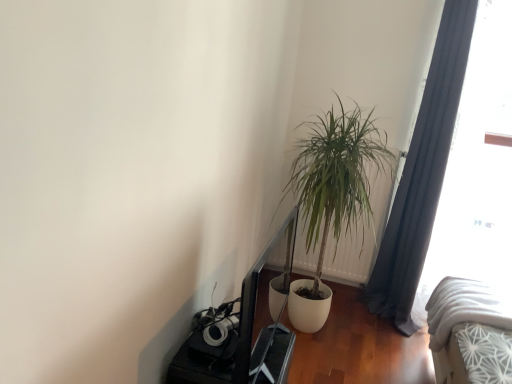
The height and width of the screenshot is (384, 512). What do you see at coordinates (333, 195) in the screenshot?
I see `green leafy plant at center` at bounding box center [333, 195].

The image size is (512, 384). Find the location of `dark gray fabric curtain at right`. dark gray fabric curtain at right is located at coordinates (422, 173).

This screenshot has width=512, height=384. Describe the element at coordinates (476, 167) in the screenshot. I see `transparent glass window at right` at that location.

This screenshot has width=512, height=384. In order to click on green leafy plant at center in this screenshot , I will do `click(333, 195)`.

From the image's perspective, is green leafy plant at center positioned above or below transparent glass window at right?

green leafy plant at center is situated lower than transparent glass window at right in the image.

Is green leafy plant at center thinner than transparent glass window at right?

In fact, green leafy plant at center might be wider than transparent glass window at right.

In the scene shown: From a real-world perspective, which is physically below, green leafy plant at center or transparent glass window at right?

green leafy plant at center.

Is green leafy plant at center positioned with its back to transparent glass window at right?

green leafy plant at center does not have its back to transparent glass window at right.

Considering the relative positions of white plastic radiator at center-right and transparent glass window at right in the image provided, is white plastic radiator at center-right to the right of transparent glass window at right from the viewer's perspective?

Incorrect, white plastic radiator at center-right is not on the right side of transparent glass window at right.

Does white plastic radiator at center-right have a larger size compared to transparent glass window at right?

Actually, white plastic radiator at center-right might be smaller than transparent glass window at right.

Does point (387, 169) appear closer or farther from the camera than point (458, 145)?

Point (387, 169) appears to be farther away from the viewer than point (458, 145).

Is white plastic radiator at center-right beside transparent glass window at right?

No, white plastic radiator at center-right is not making contact with transparent glass window at right.

From the image's perspective, is dark gray fabric curtain at right on green leafy plant at center?

Yes, from the image's perspective, dark gray fabric curtain at right is on top of green leafy plant at center.

Looking at this image, considering the sizes of dark gray fabric curtain at right and green leafy plant at center in the image, is dark gray fabric curtain at right wider or thinner than green leafy plant at center?

In the image, dark gray fabric curtain at right appears to be more narrow than green leafy plant at center.

Can you confirm if dark gray fabric curtain at right is shorter than green leafy plant at center?

In fact, dark gray fabric curtain at right may be taller than green leafy plant at center.

Is dark gray fabric curtain at right situated inside green leafy plant at center or outside?

dark gray fabric curtain at right cannot be found inside green leafy plant at center.

What's the angular difference between dark gray fabric curtain at right and transparent glass window at right's facing directions?

The angle between the facing direction of dark gray fabric curtain at right and the facing direction of transparent glass window at right is 0.000918 degrees.

Is transparent glass window at right surrounded by dark gray fabric curtain at right?

No, transparent glass window at right is located outside of dark gray fabric curtain at right.

Considering the sizes of dark gray fabric curtain at right and transparent glass window at right in the image, is dark gray fabric curtain at right bigger or smaller than transparent glass window at right?

In the image, dark gray fabric curtain at right appears to be smaller than transparent glass window at right.

Is dark gray fabric curtain at right looking in the opposite direction of transparent glass window at right?

dark gray fabric curtain at right does not have its back to transparent glass window at right.

Which is behind, white textured bed at lower right or dark gray fabric curtain at right?

dark gray fabric curtain at right is further away from the camera.

Find the location of `curtain behind the white textured bed at lower right`. curtain behind the white textured bed at lower right is located at coordinates [422, 173].

From a real-world perspective, is white textured bed at lower right located beneath dark gray fabric curtain at right?

Yes, from a real-world perspective, white textured bed at lower right is below dark gray fabric curtain at right.

Between white textured bed at lower right and dark gray fabric curtain at right, which one has more height?

With more height is dark gray fabric curtain at right.

Which object is closer to the camera taking this photo, green leafy plant at center or white textured bed at lower right?

white textured bed at lower right is closer to the camera.

Is green leafy plant at center at the left side of white textured bed at lower right?

Yes.

Is green leafy plant at center facing away from white textured bed at lower right?

That's not correct — green leafy plant at center is not looking away from white textured bed at lower right.

How many degrees apart are the facing directions of green leafy plant at center and white textured bed at lower right?

178 degrees separate the facing orientations of green leafy plant at center and white textured bed at lower right.

Which is farther from the camera, (314, 231) or (422, 218)?

The point (422, 218) is farther.

Where is `houseplant on the left of dark gray fabric curtain at right`? The image size is (512, 384). houseplant on the left of dark gray fabric curtain at right is located at coordinates (333, 195).

Is green leafy plant at center smaller than dark gray fabric curtain at right?

Incorrect, green leafy plant at center is not smaller in size than dark gray fabric curtain at right.

At what (x,y) coordinates should I click in order to perform the action: click on window screen that appears behind the green leafy plant at center. Please return your answer as a coordinate pair (x, y). The width and height of the screenshot is (512, 384). Looking at the image, I should click on (476, 167).

The width and height of the screenshot is (512, 384). Find the location of `window screen in front of the white plastic radiator at center-right`. window screen in front of the white plastic radiator at center-right is located at coordinates (476, 167).

Based on the photo, based on their spatial positions, is green leafy plant at center or transparent glass window at right further from white plastic radiator at center-right?

The object further to white plastic radiator at center-right is transparent glass window at right.

Estimate the real-world distances between objects in this image. Which object is further from green leafy plant at center, white textured bed at lower right or dark gray fabric curtain at right?

white textured bed at lower right is further to green leafy plant at center.

Looking at the image, which one is located further to green leafy plant at center, white textured bed at lower right or white plastic radiator at center-right?

The object further to green leafy plant at center is white textured bed at lower right.

Based on their spatial positions, is green leafy plant at center or transparent glass window at right further from white textured bed at lower right?

green leafy plant at center is further to white textured bed at lower right.

Which object lies further to the anchor point white plastic radiator at center-right, white textured bed at lower right or dark gray fabric curtain at right?

The object further to white plastic radiator at center-right is white textured bed at lower right.

Estimate the real-world distances between objects in this image. Which object is closer to white plastic radiator at center-right, transparent glass window at right or green leafy plant at center?

green leafy plant at center is positioned closer to the anchor white plastic radiator at center-right.

When comparing their distances from transparent glass window at right, does white plastic radiator at center-right or dark gray fabric curtain at right seem further?

white plastic radiator at center-right is positioned further to the anchor transparent glass window at right.

Based on their spatial positions, is green leafy plant at center or white plastic radiator at center-right closer to dark gray fabric curtain at right?

white plastic radiator at center-right is positioned closer to the anchor dark gray fabric curtain at right.

What are the coordinates of `window screen positioned between white textured bed at lower right and white plastic radiator at center-right from near to far` in the screenshot? It's located at (476, 167).

You are a GUI agent. You are given a task and a screenshot of the screen. Output one action in this format:
    pyautogui.click(x=<x>, y=<y>)
    Task: Click on the curtain between white plastic radiator at center-right and transparent glass window at right from left to right
    
    Given the screenshot: What is the action you would take?
    pyautogui.click(x=422, y=173)

The height and width of the screenshot is (384, 512). Find the location of `radiator between green leafy plant at center and transparent glass window at right from left to right`. radiator between green leafy plant at center and transparent glass window at right from left to right is located at coordinates (364, 228).

Find the location of a particular element. The width and height of the screenshot is (512, 384). curtain located between green leafy plant at center and white plastic radiator at center-right in the depth direction is located at coordinates (422, 173).